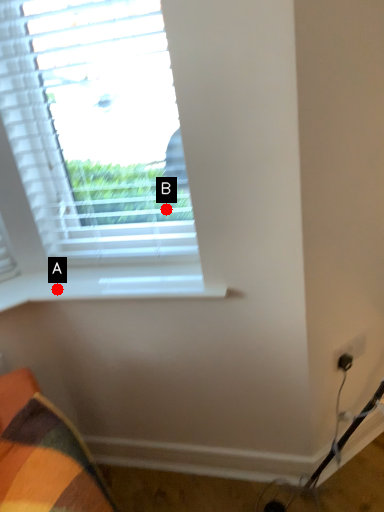
Question: Two points are circled on the image, labeled by A and B beside each circle. Which of the following is the closest to the observer?

Choices:
 (A) A is closer
 (B) B is closer

Answer: (A)